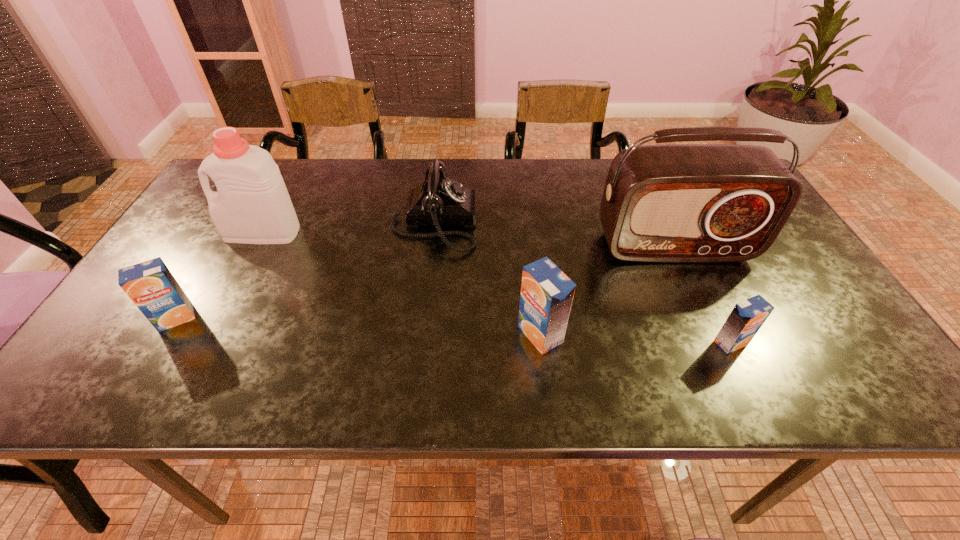
Find the location of a particular element. the second shortest orange_juice is located at coordinates (151, 286).

The width and height of the screenshot is (960, 540). Find the location of `the third tallest object`. the third tallest object is located at coordinates (547, 293).

The image size is (960, 540). In order to click on the tallest orange_juice in this screenshot , I will do `click(547, 293)`.

Locate an element on the screen. the shortest object is located at coordinates tap(747, 317).

The height and width of the screenshot is (540, 960). Find the location of `the shortest orange_juice`. the shortest orange_juice is located at coordinates (747, 317).

In order to click on radio receiver in this screenshot , I will do `click(674, 203)`.

This screenshot has height=540, width=960. What are the coordinates of `the third object from left to right` in the screenshot? It's located at (438, 201).

Find the location of a particular element. The height and width of the screenshot is (540, 960). detergent is located at coordinates (252, 205).

You are a GUI agent. You are given a task and a screenshot of the screen. Output one action in this format:
    pyautogui.click(x=<x>, y=<y>)
    Task: Click on the free space located on the back of the leftmost orange_juice
    The image size is (960, 540).
    Given the screenshot: What is the action you would take?
    pyautogui.click(x=214, y=256)

I want to click on free space located on the right of the third tallest object, so click(744, 334).